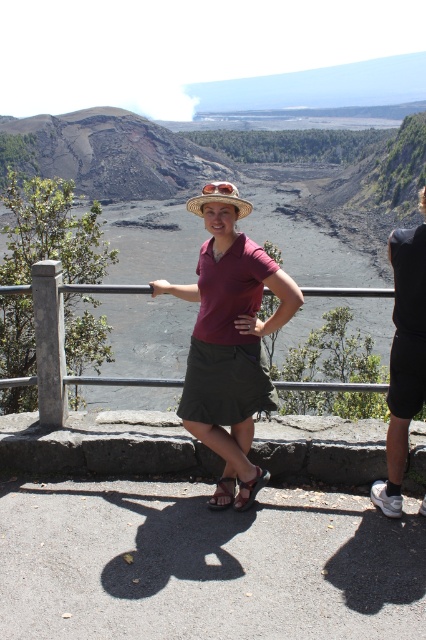
Can you confirm if dark gray shorts at right is shorter than brown leather sandal at center?

In fact, dark gray shorts at right may be taller than brown leather sandal at center.

Which is behind, point (423, 202) or point (247, 504)?

The point (247, 504) is more distant.

Is point (402, 253) farther from viewer compared to point (259, 483)?

No, (402, 253) is closer to viewer.

What are the coordinates of `dark gray shorts at right` in the screenshot? It's located at (405, 356).

Can you confirm if brown leather sandal at center is positioned to the left of brown leather sandal at lower center?

Incorrect, brown leather sandal at center is not on the left side of brown leather sandal at lower center.

Is point (253, 484) positioned after point (233, 493)?

No, it is not.

This screenshot has width=426, height=640. Find the location of `brown leather sandal at center`. brown leather sandal at center is located at coordinates (250, 490).

Who is lower down, dark gray shorts at right or brown leather sandal at lower center?

brown leather sandal at lower center is below.

Does dark gray shorts at right appear on the right side of brown leather sandal at lower center?

Correct, you'll find dark gray shorts at right to the right of brown leather sandal at lower center.

Which is in front, point (408, 362) or point (233, 492)?

Point (408, 362) is in front.

The width and height of the screenshot is (426, 640). In order to click on dark gray shorts at right in this screenshot , I will do `click(405, 356)`.